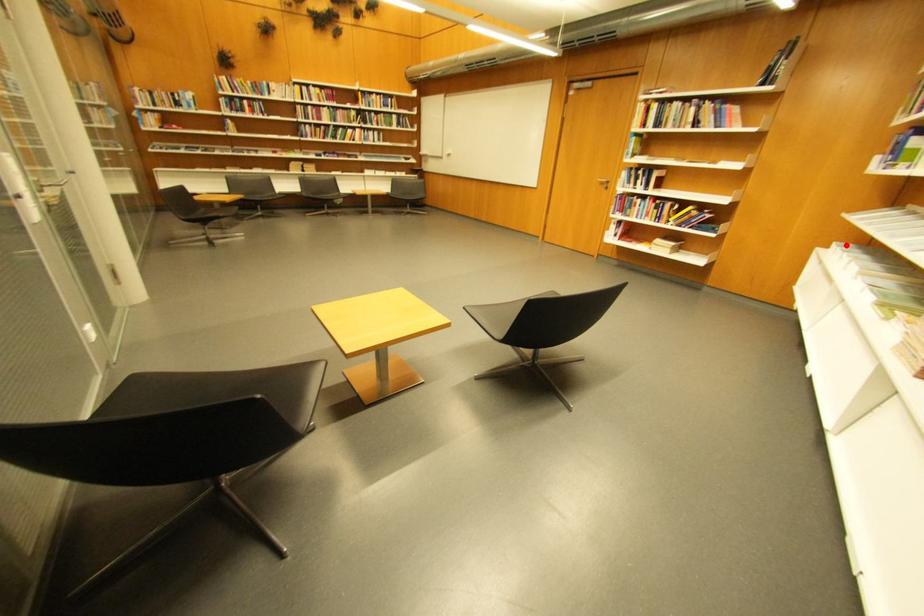
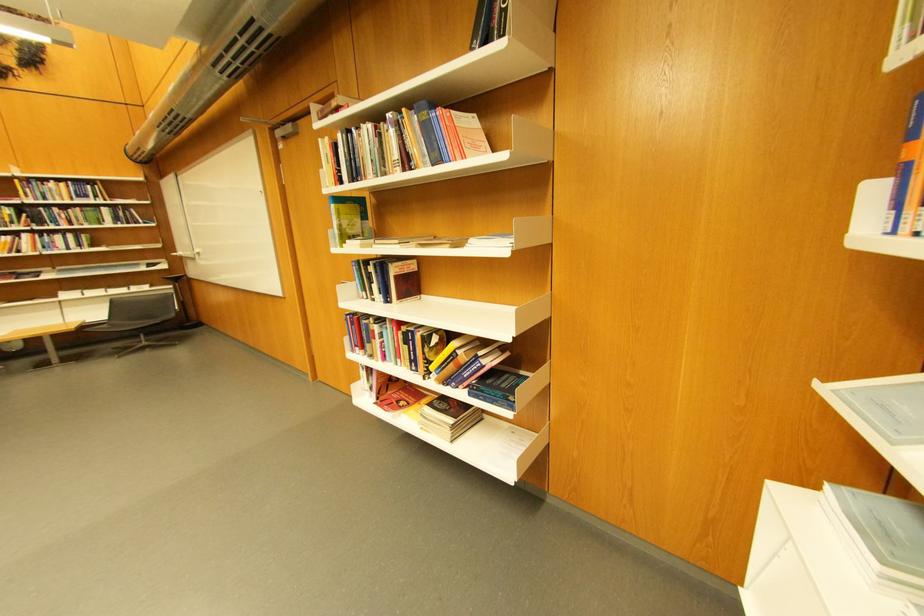
Question: I am providing you with two images of the same scene from different viewpoints. In image1, a red point is highlighted. Considering the same 3D point in image2, which of the following is correct?

Choices:
 (A) It is closer
 (B) It is farther

Answer: (A)